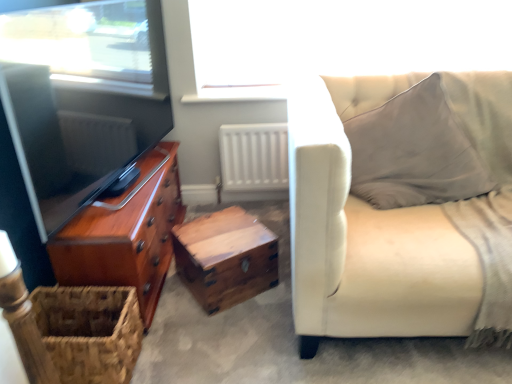
Locate an element on the screen. vacant area that is situated to the right of woven brown basket at lower left is located at coordinates (173, 352).